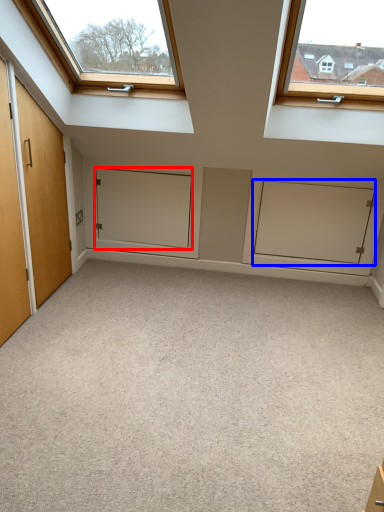
Question: Which point is closer to the camera, door (highlighted by a red box) or cabinetry (highlighted by a blue box)?

Choices:
 (A) door
 (B) cabinetry

Answer: (B)